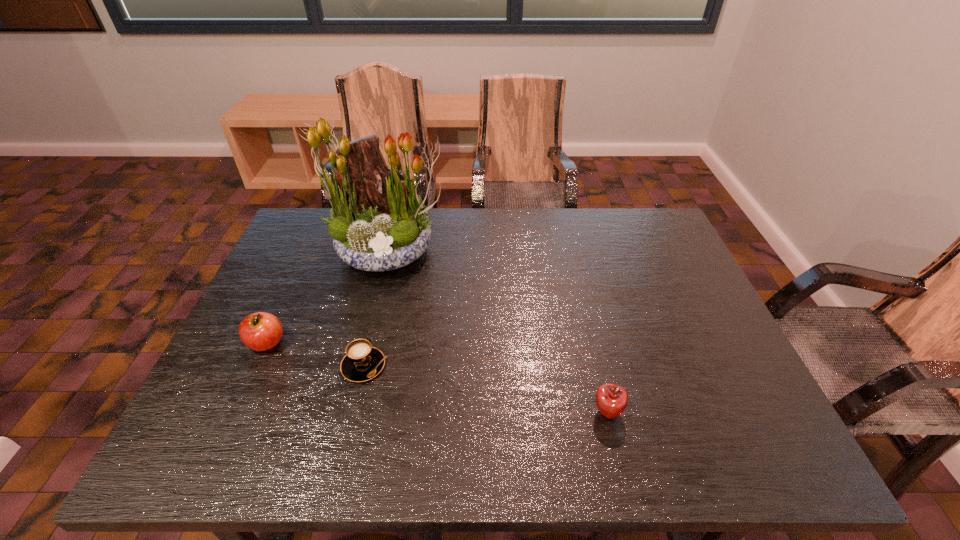
Find the location of `flower arrangement`. flower arrangement is located at coordinates (372, 229).

At what (x,y) coordinates should I click in order to perform the action: click on the tallest object. Please return your answer as a coordinate pair (x, y). The height and width of the screenshot is (540, 960). Looking at the image, I should click on (372, 229).

Find the location of a particular element. Image resolution: width=960 pixels, height=540 pixels. the left apple is located at coordinates (261, 331).

You are a GUI agent. You are given a task and a screenshot of the screen. Output one action in this format:
    pyautogui.click(x=<x>, y=<y>)
    Task: Click on the leftmost object
    
    Given the screenshot: What is the action you would take?
    pos(261,331)

Where is `the right apple`? Image resolution: width=960 pixels, height=540 pixels. the right apple is located at coordinates (611, 400).

The height and width of the screenshot is (540, 960). I want to click on the rightmost object, so click(x=611, y=400).

At what (x,y) coordinates should I click in order to perform the action: click on cappuccino. Please return your answer as a coordinate pair (x, y). Looking at the image, I should click on (362, 362).

This screenshot has height=540, width=960. In order to click on free space located 0.090m on the front-facing side of the tallest object in this screenshot , I will do `click(374, 306)`.

The height and width of the screenshot is (540, 960). What are the coordinates of `free space located 0.260m on the back of the leftmost object` in the screenshot? It's located at (303, 262).

Where is `vacant space located on the front of the right apple`? The width and height of the screenshot is (960, 540). vacant space located on the front of the right apple is located at coordinates (619, 464).